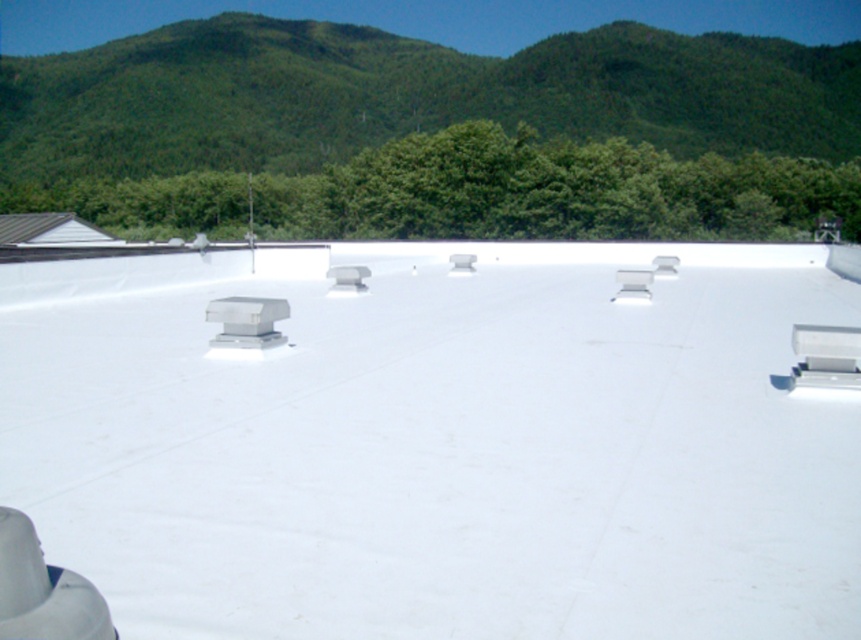
Question: Can you confirm if green forested hill at upper center is wider than metallic gray roof at left?

Choices:
 (A) yes
 (B) no

Answer: (A)

Question: Is green forested hill at upper center to the left of metallic gray roof at left from the viewer's perspective?

Choices:
 (A) yes
 (B) no

Answer: (B)

Question: Which object is closer to the camera taking this photo?

Choices:
 (A) green forested hill at upper center
 (B) metallic gray roof at left

Answer: (B)

Question: Which point appears closest to the camera in this image?

Choices:
 (A) (63, 212)
 (B) (652, 131)

Answer: (A)

Question: Is green forested hill at upper center in front of metallic gray roof at left?

Choices:
 (A) yes
 (B) no

Answer: (B)